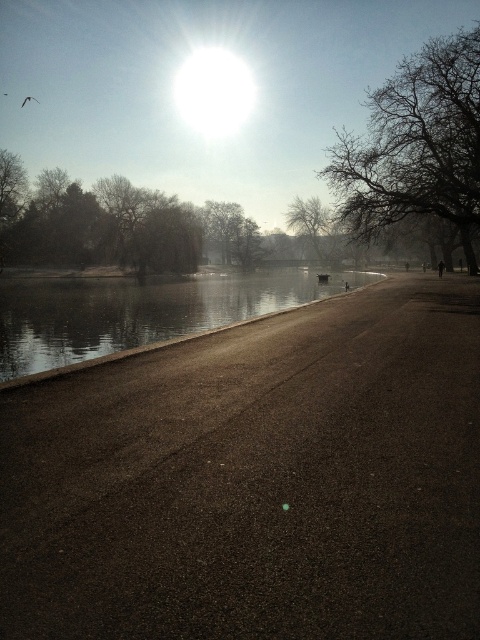
The width and height of the screenshot is (480, 640). Describe the element at coordinates (111, 225) in the screenshot. I see `green leafy tree at upper left` at that location.

Which of these two, green leafy tree at upper left or bare branches at center, stands taller?

Standing taller between the two is bare branches at center.

The image size is (480, 640). Find the location of `green leafy tree at upper left`. green leafy tree at upper left is located at coordinates (111, 225).

You are a GUI agent. You are given a task and a screenshot of the screen. Output one action in this format:
    pyautogui.click(x=<x>, y=<y>)
    Task: Click on the green leafy tree at upper left
    
    Given the screenshot: What is the action you would take?
    pyautogui.click(x=111, y=225)

Which is above, smooth concrete river at center or green leafy tree at upper left?

Positioned higher is green leafy tree at upper left.

Between smooth concrete river at center and green leafy tree at upper left, which one appears on the right side from the viewer's perspective?

smooth concrete river at center is more to the right.

Between point (269, 284) and point (79, 204), which one is positioned in front?

Positioned in front is point (269, 284).

You are a GUI agent. You are given a task and a screenshot of the screen. Output one action in this format:
    pyautogui.click(x=<x>, y=<y>)
    Task: Click on the smooth concrete river at center
    This screenshot has width=480, height=640.
    Given the screenshot: What is the action you would take?
    pyautogui.click(x=141, y=312)

Can you confirm if bare branches at upper right is positioned above bare branches at center?

Yes, bare branches at upper right is above bare branches at center.

Is bare branches at upper right further to camera compared to bare branches at center?

No, bare branches at upper right is in front of bare branches at center.

Where is `bare branches at upper right`? bare branches at upper right is located at coordinates (417, 145).

The height and width of the screenshot is (640, 480). In order to click on bare branches at upper right in this screenshot , I will do `click(417, 145)`.